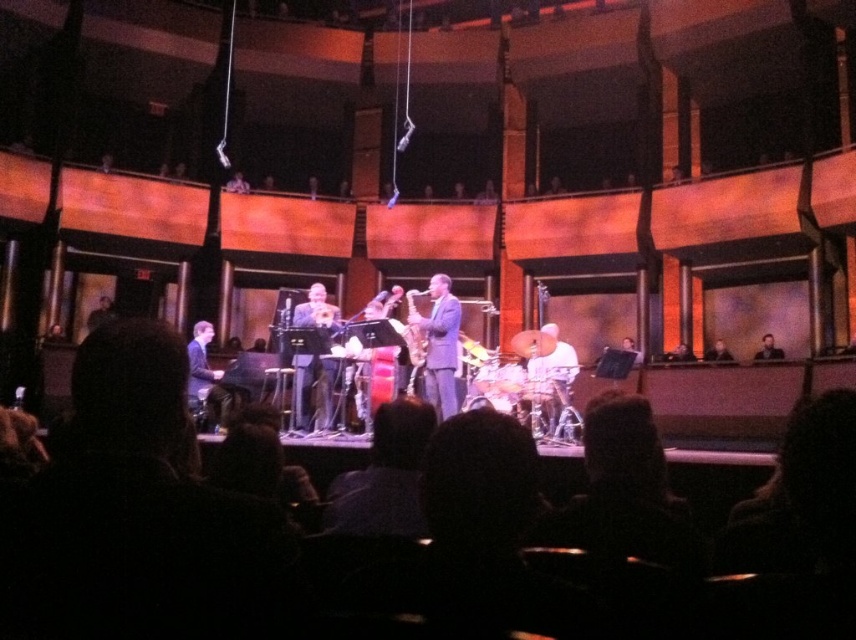
Measure the distance between shiny silver saxophone at center and smooth brown leather jacket at upper right.

shiny silver saxophone at center and smooth brown leather jacket at upper right are 8.07 meters apart.

Is shiny silver saxophone at center shorter than smooth brown leather jacket at upper right?

No.

What do you see at coordinates (438, 342) in the screenshot?
I see `shiny silver saxophone at center` at bounding box center [438, 342].

Where is `shiny silver saxophone at center`? Image resolution: width=856 pixels, height=640 pixels. shiny silver saxophone at center is located at coordinates (438, 342).

Which is in front, point (409, 323) or point (296, 420)?

Point (409, 323) is more forward.

The height and width of the screenshot is (640, 856). Identify the location of shiny silver saxophone at center. (438, 342).

Is matte black piano at lower left thinner than light brown wooden chair at right?

Yes, matte black piano at lower left is thinner than light brown wooden chair at right.

Locate an element on the screen. The height and width of the screenshot is (640, 856). matte black piano at lower left is located at coordinates (201, 376).